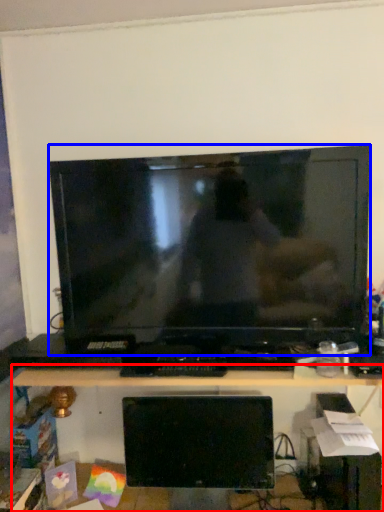
Question: Which object appears farthest to the camera in this image, desk (highlighted by a red box) or television (highlighted by a blue box)?

Choices:
 (A) desk
 (B) television

Answer: (B)